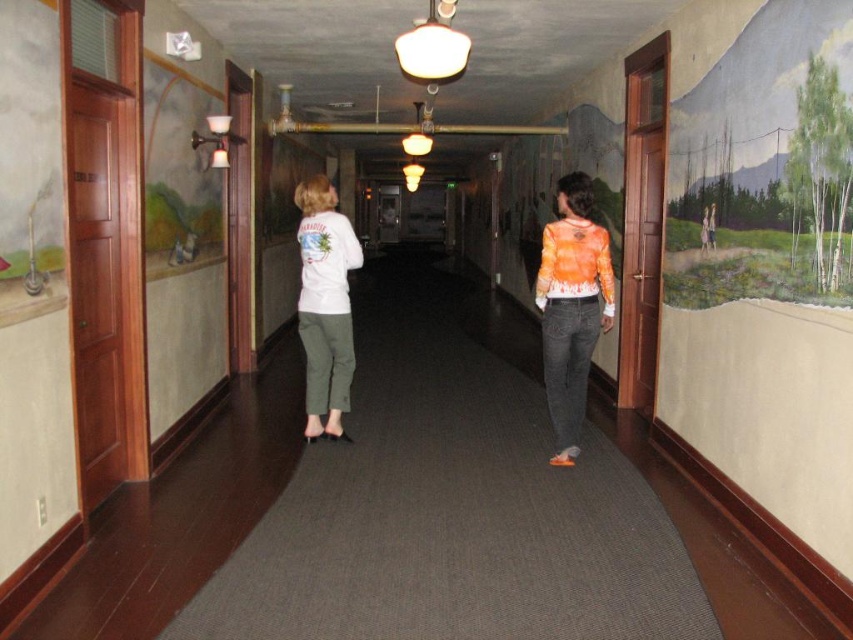
You are standing at the entrance of the hallway and notice an orange tie dye shirt at center. Can you confirm if the orange tie dye shirt at center is located exactly at the point with coordinates (572, 307)?

The orange tie dye shirt at center is located exactly at the point with coordinates (572, 307).